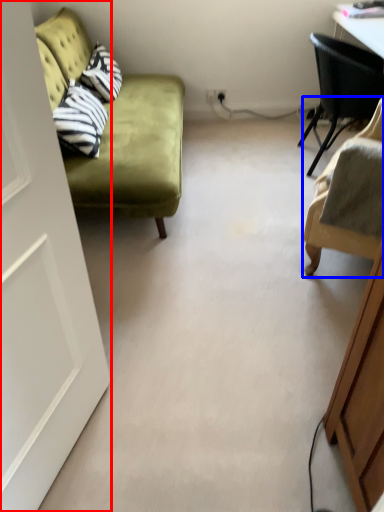
Question: Among these objects, which one is farthest to the camera, door (highlighted by a red box) or chair (highlighted by a blue box)?

Choices:
 (A) door
 (B) chair

Answer: (B)